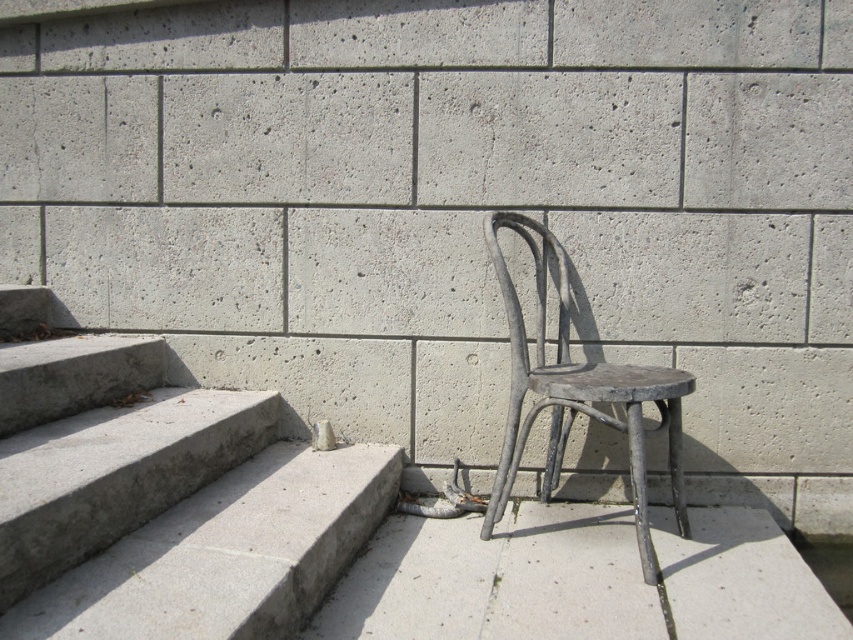
Image resolution: width=853 pixels, height=640 pixels. What do you see at coordinates (497, 580) in the screenshot? I see `gray concrete at lower right` at bounding box center [497, 580].

Is gray concrete at lower right positioned behind rusty metal chair at center?

No, gray concrete at lower right is in front of rusty metal chair at center.

What are the coordinates of `gray concrete at lower right` in the screenshot? It's located at (497, 580).

Is gray concrete stairs at lower left to the left of gray concrete at lower right from the viewer's perspective?

Yes, gray concrete stairs at lower left is to the left of gray concrete at lower right.

Between point (21, 300) and point (782, 545), which one is positioned in front?

Point (782, 545) is in front.

Locate an element on the screen. gray concrete stairs at lower left is located at coordinates (161, 496).

Between gray concrete stairs at lower left and rusty metal chair at center, which one appears on the left side from the viewer's perspective?

gray concrete stairs at lower left

Which of these two, gray concrete stairs at lower left or rusty metal chair at center, stands shorter?

gray concrete stairs at lower left is shorter.

Locate an element on the screen. The image size is (853, 640). gray concrete stairs at lower left is located at coordinates (161, 496).